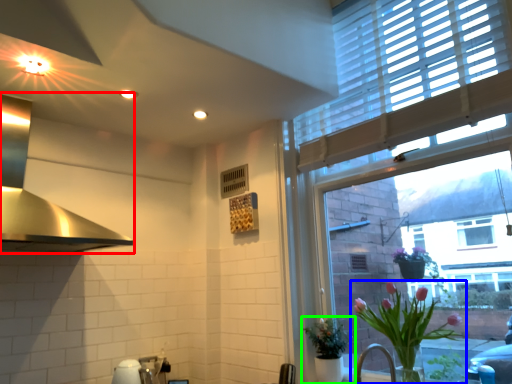
Question: Considering the real-world distances, which object is farthest from exhaust hood (highlighted by a red box)? houseplant (highlighted by a blue box) or houseplant (highlighted by a green box)?

Choices:
 (A) houseplant
 (B) houseplant

Answer: (A)